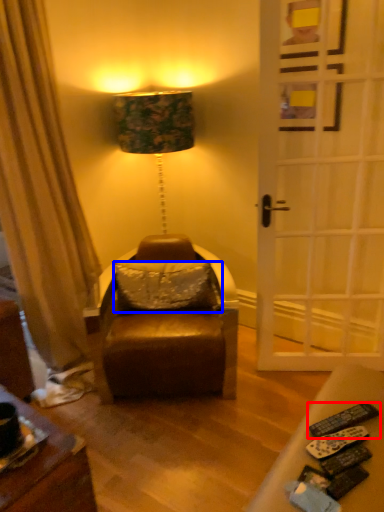
Question: Which object is further to the camera taking this photo, remote control (highlighted by a red box) or pillow (highlighted by a blue box)?

Choices:
 (A) remote control
 (B) pillow

Answer: (B)